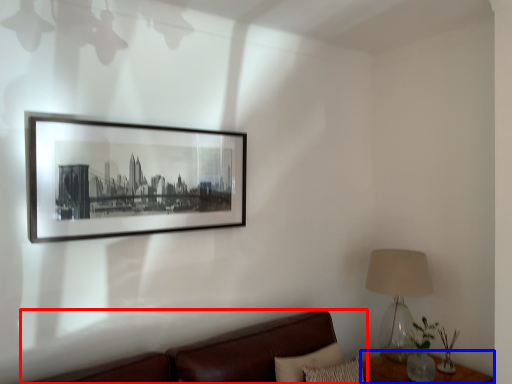
Question: Which of the following is the closest to the observer, studio couch (highlighted by a red box) or table (highlighted by a blue box)?

Choices:
 (A) studio couch
 (B) table

Answer: (A)